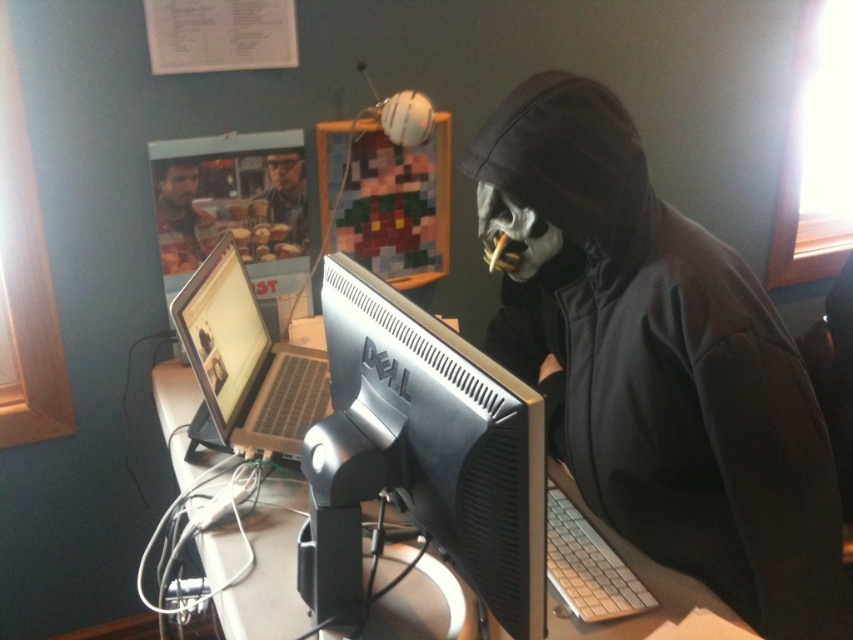
Question: Among these objects, which one is nearest to the camera?

Choices:
 (A) black matte hoodie at center
 (B) matte plastic cup at upper center

Answer: (A)

Question: Which point is closer to the camera taking this photo?

Choices:
 (A) (183, 392)
 (B) (457, 458)

Answer: (B)

Question: Is black matte computer monitor at center wider than smooth skin face at upper left?

Choices:
 (A) no
 (B) yes

Answer: (B)

Question: Based on their relative distances, which object is farther from the black matte hoodie at center?

Choices:
 (A) smooth skin face at upper left
 (B) silver metallic laptop at left
 (C) matte gray desk at center

Answer: (A)

Question: Observing the image, what is the correct spatial positioning of black matte computer monitor at center in reference to silver metallic laptop at left?

Choices:
 (A) above
 (B) below

Answer: (B)

Question: Can you confirm if black matte hoodie at center is wider than silver metallic laptop at left?

Choices:
 (A) no
 (B) yes

Answer: (B)